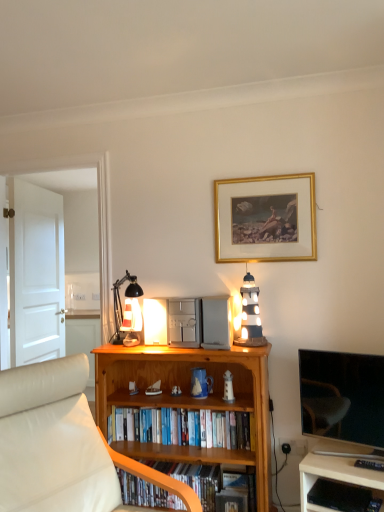
Question: Is white leather studio couch at lower left at the left side of hardcover books at center, positioned as the 1th book in top-to-bottom order?

Choices:
 (A) yes
 (B) no

Answer: (A)

Question: Would you say white leather studio couch at lower left contains hardcover books at center, positioned as the 1th book in top-to-bottom order?

Choices:
 (A) no
 (B) yes

Answer: (A)

Question: Can you confirm if white leather studio couch at lower left is shorter than hardcover books at center, the second book from the bottom?

Choices:
 (A) no
 (B) yes

Answer: (A)

Question: Is white leather studio couch at lower left positioned far away from hardcover books at center, the second book from the bottom?

Choices:
 (A) no
 (B) yes

Answer: (A)

Question: Is white leather studio couch at lower left thinner than hardcover books at center, the second book from the bottom?

Choices:
 (A) yes
 (B) no

Answer: (B)

Question: Is hardcover books at center, positioned as the 1th book in top-to-bottom order, spatially inside wooden bookcase at center, or outside of it?

Choices:
 (A) inside
 (B) outside

Answer: (A)

Question: Would you say hardcover books at center, the second book from the bottom, is to the left or to the right of wooden bookcase at center in the picture?

Choices:
 (A) right
 (B) left

Answer: (B)

Question: From their relative heights in the image, would you say hardcover books at center, positioned as the 1th book in top-to-bottom order, is taller or shorter than wooden bookcase at center?

Choices:
 (A) tall
 (B) short

Answer: (B)

Question: Looking at their shapes, would you say hardcover books at center, the second book from the bottom, is wider or thinner than wooden bookcase at center?

Choices:
 (A) thin
 (B) wide

Answer: (A)

Question: From a real-world perspective, is white leather studio couch at lower left physically located above or below gold/gilded picture frame at upper center?

Choices:
 (A) above
 (B) below

Answer: (B)

Question: Which is correct: white leather studio couch at lower left is inside gold/gilded picture frame at upper center, or outside of it?

Choices:
 (A) inside
 (B) outside

Answer: (B)

Question: In terms of height, does white leather studio couch at lower left look taller or shorter compared to gold/gilded picture frame at upper center?

Choices:
 (A) tall
 (B) short

Answer: (A)

Question: In the image, is white leather studio couch at lower left on the left side or the right side of gold/gilded picture frame at upper center?

Choices:
 (A) right
 (B) left

Answer: (B)

Question: From the image's perspective, is matte white glass table lamp at upper center above or below wooden shelf at lower center, the 2th book in the top-to-bottom sequence?

Choices:
 (A) below
 (B) above

Answer: (B)

Question: Would you say matte white glass table lamp at upper center is to the left or to the right of wooden shelf at lower center, the 2th book in the top-to-bottom sequence, in the picture?

Choices:
 (A) left
 (B) right

Answer: (A)